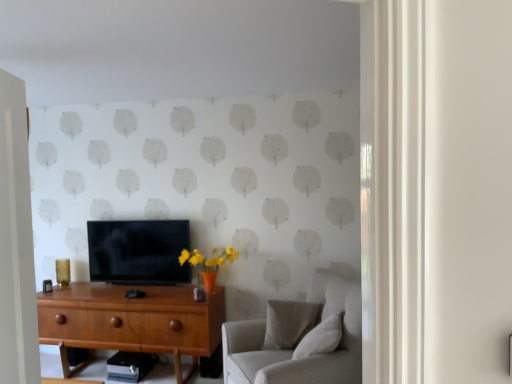
Question: Does matte black tv at center have a smaller size compared to light gray fabric couch at right?

Choices:
 (A) no
 (B) yes

Answer: (B)

Question: Considering the relative sizes of matte black tv at center and light gray fabric couch at right in the image provided, is matte black tv at center wider than light gray fabric couch at right?

Choices:
 (A) no
 (B) yes

Answer: (A)

Question: Is matte black tv at center facing away from light gray fabric couch at right?

Choices:
 (A) no
 (B) yes

Answer: (A)

Question: Could you tell me if matte black tv at center is turned towards light gray fabric couch at right?

Choices:
 (A) no
 (B) yes

Answer: (A)

Question: From a real-world perspective, is matte black tv at center on light gray fabric couch at right?

Choices:
 (A) yes
 (B) no

Answer: (A)

Question: Is the position of matte black tv at center more distant than that of light gray fabric couch at right?

Choices:
 (A) no
 (B) yes

Answer: (B)

Question: Does white textured pillow at lower right, placed as the second pillow when sorted from back to front, have a lesser height compared to wooden desk at center?

Choices:
 (A) yes
 (B) no

Answer: (A)

Question: Considering the relative positions of white textured pillow at lower right, placed as the second pillow when sorted from back to front, and wooden desk at center in the image provided, is white textured pillow at lower right, placed as the second pillow when sorted from back to front, behind wooden desk at center?

Choices:
 (A) no
 (B) yes

Answer: (A)

Question: Is white textured pillow at lower right, which is the first pillow from front to back, wider than wooden desk at center?

Choices:
 (A) no
 (B) yes

Answer: (A)

Question: Is white textured pillow at lower right, placed as the second pillow when sorted from back to front, surrounding wooden desk at center?

Choices:
 (A) no
 (B) yes

Answer: (A)

Question: Does white textured pillow at lower right, which is the first pillow from front to back, have a lesser width compared to wooden desk at center?

Choices:
 (A) no
 (B) yes

Answer: (B)

Question: Is white textured pillow at lower right, which is the first pillow from front to back, directly adjacent to wooden desk at center?

Choices:
 (A) yes
 (B) no

Answer: (B)

Question: From a real-world perspective, is light gray fabric pillow at center, positioned as the 1th pillow in back-to-front order, on top of wooden desk at center?

Choices:
 (A) yes
 (B) no

Answer: (A)